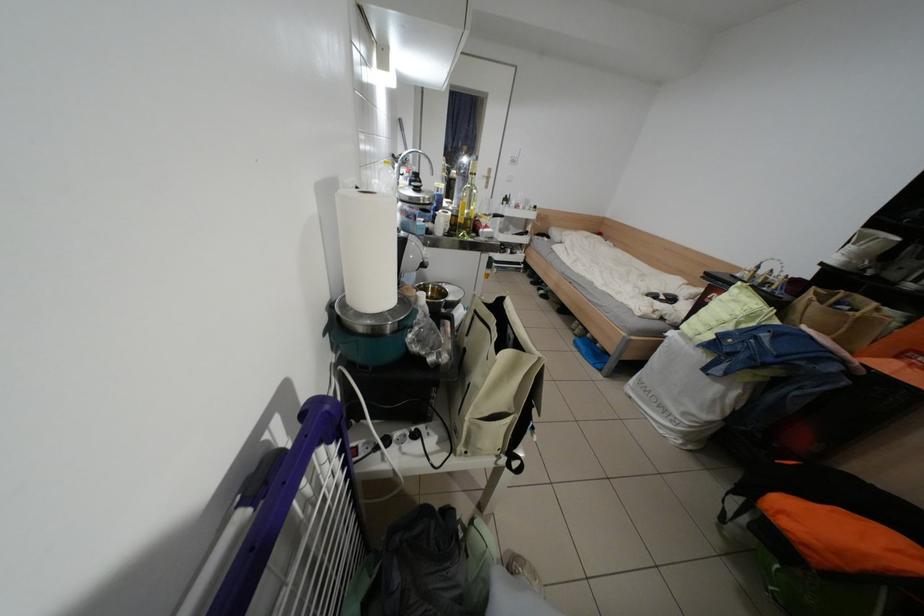
What do you see at coordinates (488, 177) in the screenshot? This screenshot has width=924, height=616. I see `the silver door handle` at bounding box center [488, 177].